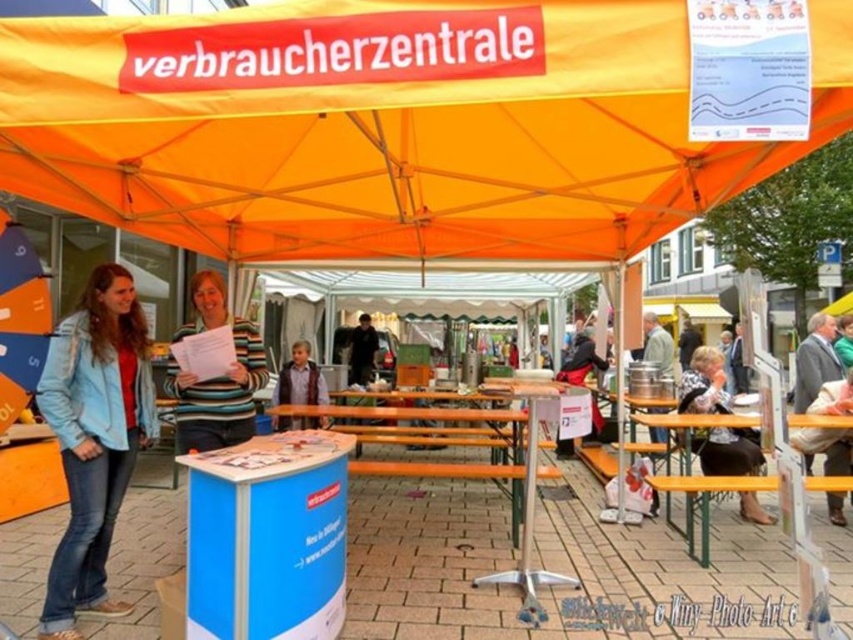
Who is lower down, blue denim jacket at lower left or orange fabric umbrella at left?

Positioned lower is blue denim jacket at lower left.

Is blue denim jacket at lower left closer to camera compared to orange fabric umbrella at left?

Yes, blue denim jacket at lower left is in front of orange fabric umbrella at left.

Identify the location of blue denim jacket at lower left. This screenshot has width=853, height=640. (94, 436).

Who is shorter, blue denim jacket at lower left or striped sweater at center?

striped sweater at center is shorter.

Where is `blue denim jacket at lower left`? blue denim jacket at lower left is located at coordinates (94, 436).

The image size is (853, 640). In order to click on blue denim jacket at lower left in this screenshot , I will do `click(94, 436)`.

Measure the distance between point (317, 580) and camera.

Point (317, 580) and camera are 10.25 feet apart.

Is blue cardboard table at center taller than striped sweater at center?

Correct, blue cardboard table at center is much taller as striped sweater at center.

Consider the image. Who is more distant from viewer, (337,529) or (294,360)?

Point (294,360)

At what (x,y) coordinates should I click in order to perform the action: click on blue cardboard table at center. Please return your answer as a coordinate pair (x, y). Looking at the image, I should click on (267, 538).